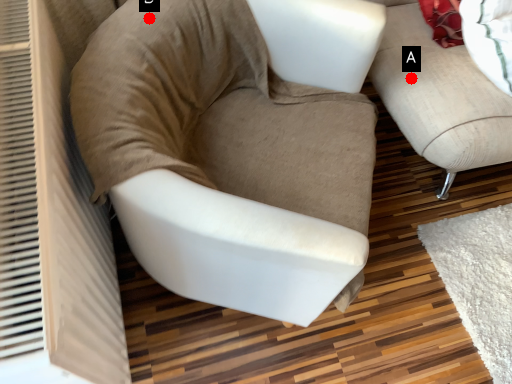
Question: Two points are circled on the image, labeled by A and B beside each circle. Among these points, which one is farthest from the camera?

Choices:
 (A) A is further
 (B) B is further

Answer: (A)